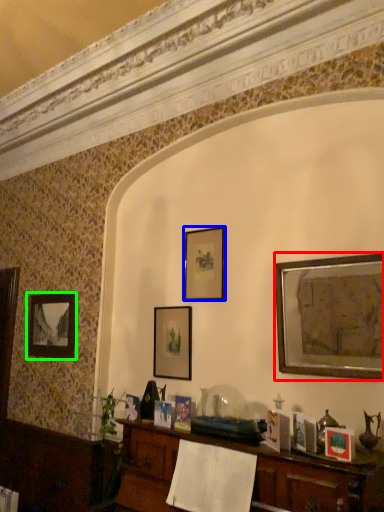
Question: Which is farther away from picture frame (highlighted by a red box)? picture frame (highlighted by a blue box) or picture frame (highlighted by a green box)?

Choices:
 (A) picture frame
 (B) picture frame

Answer: (B)